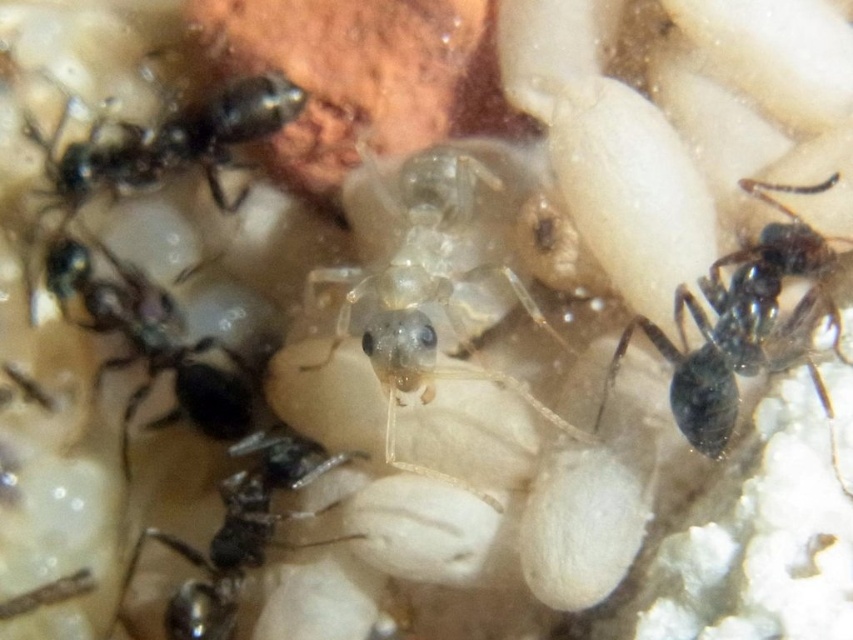
You are observing an ant colony through a microscope. The point of interest is labeled as point (384, 326). If the microscope has a focal length of 2.5 feet, can you determine if the point is within the microscope field of view?

The distance between point (384, 326) and the camera is 3.72 feet, which is greater than the microscope focal length of 2.5 feet. Therefore, the point is outside the microscope field of view.

You are an entomologist observing an ant colony. You notice two ants in the scene. The translucent gelatinous ant at center and the shiny black ant at upper left. Which ant is taller?

The translucent gelatinous ant at center is much taller than the shiny black ant at upper left.